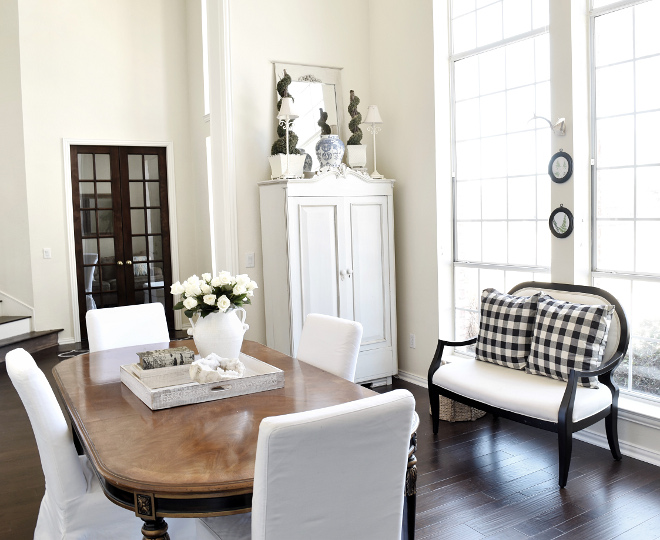
Where is `cushion`? The image size is (660, 540). cushion is located at coordinates (556, 339).